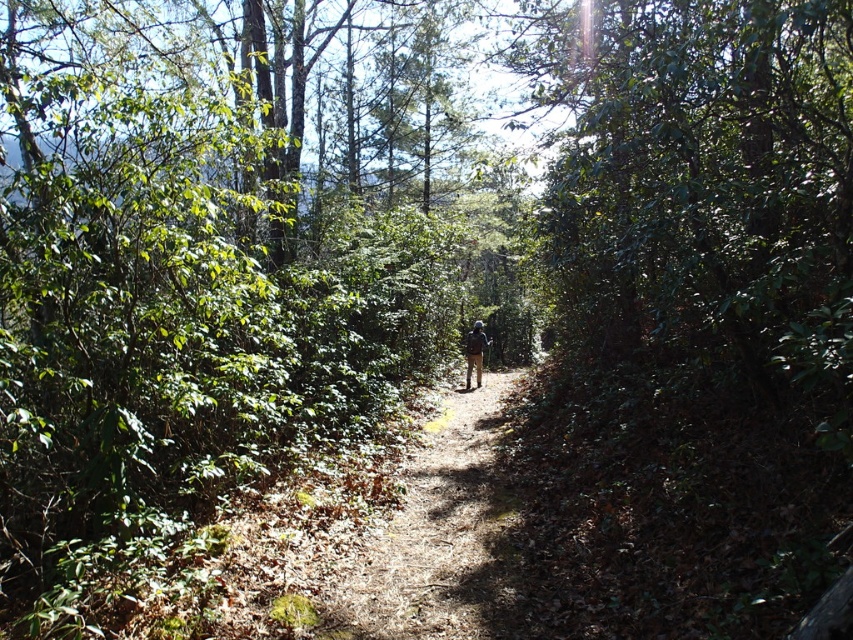
In the scene shown: You are a hiker carrying a 10 feet long ladder. You see the brown dirt path at center. Can you place the ladder horizontally on the path without bending it?

The brown dirt path at center is 13.83 feet wide, so yes, the ladder can be placed horizontally on the path since its length is shorter than the path width.

You are a hiker walking along the narrow dirt path in the forest. You notice two points marked on the ground ahead of you. The first point is at coordinates point (325, 620) and the second is at point (477, 369). Which point is closer to you as you walk along the path?

Point (325, 620) is in front of point (477, 369), so the first point is closer to you as you walk along the path.

You are a hiker who wants to stay on the brown dirt path at center. If you look at your map, what coordinates should you follow to stay on the path?

The brown dirt path at center is located at coordinates point (432, 532), so you should follow those coordinates to stay on the path.